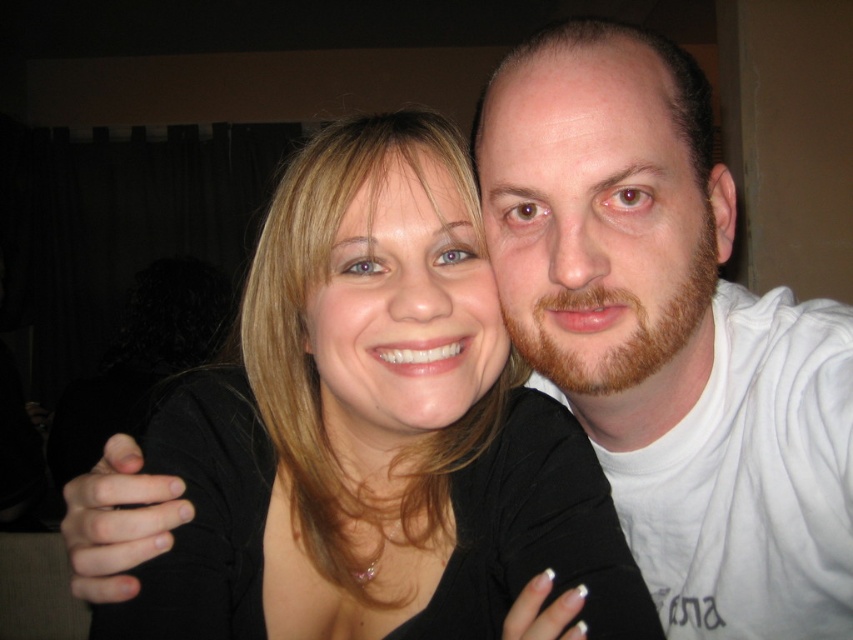
Consider the image. You are a photographer adjusting the lighting for a portrait. You notice a point at coordinates (373, 428) in the image. Based on the scene description, what object is located at that point?

The point at coordinates (373, 428) indicates the location of the black matte hair at center.

You are a photographer adjusting the focus on your camera. You notice two points in the image at coordinates point (381, 355) and point (817, 330). Which point should you focus on first if you want to ensure the person closest to the camera is in focus?

Point (381, 355) is closer to the camera than point (817, 330), so you should focus on point (381, 355) first to ensure the person closest to the camera is in focus.